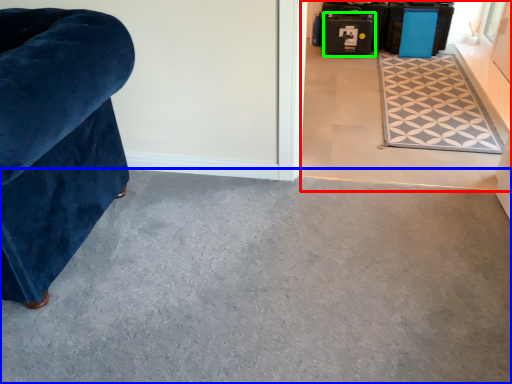
Question: Which is nearer to the concrete (highlighted by a red box)? concrete (highlighted by a blue box) or luggage (highlighted by a green box).

Choices:
 (A) concrete
 (B) luggage

Answer: (B)